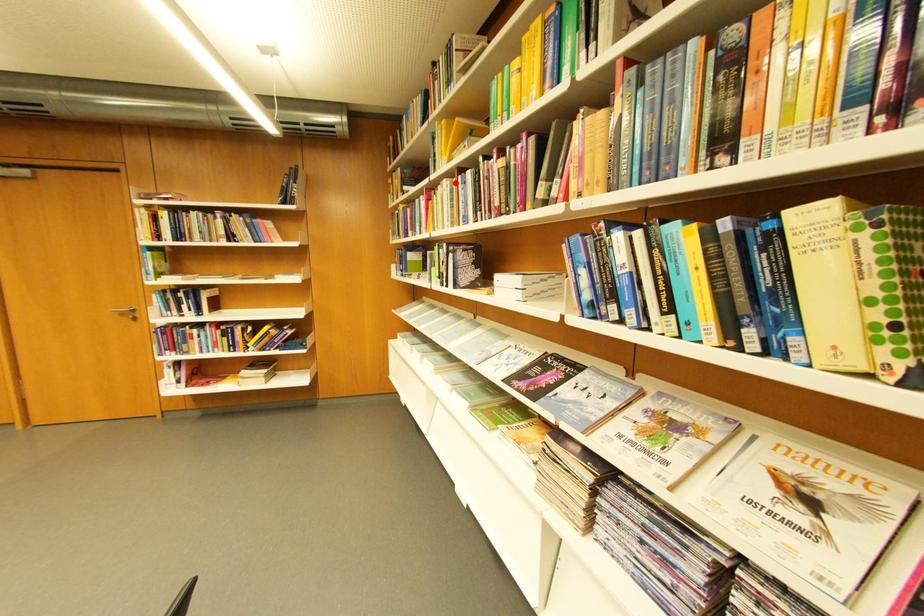
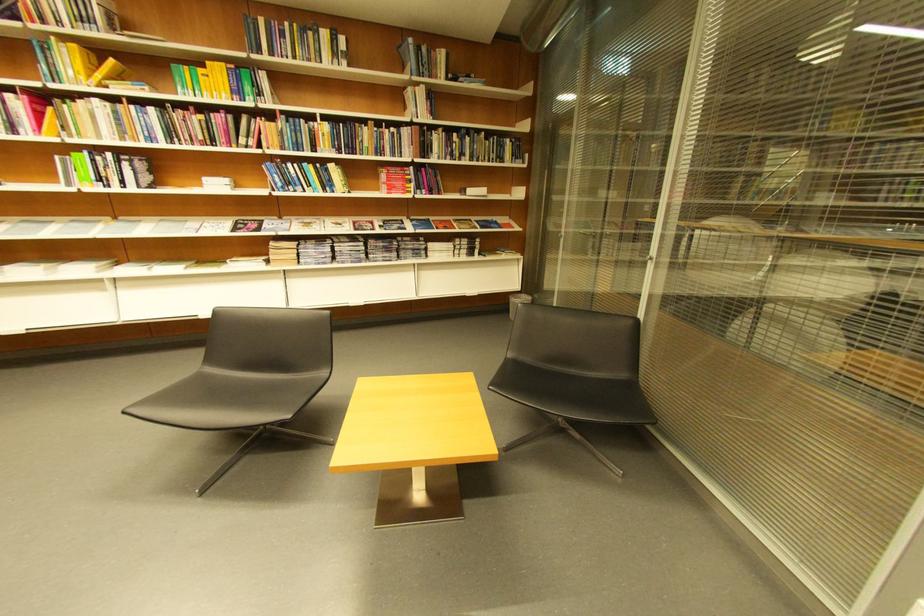
Question: I am providing you with two images of the same scene from different viewpoints. In image1, a red point is highlighted. Considering the same 3D point in image2, which of the following is correct?

Choices:
 (A) It is closer
 (B) It is farther

Answer: (B)